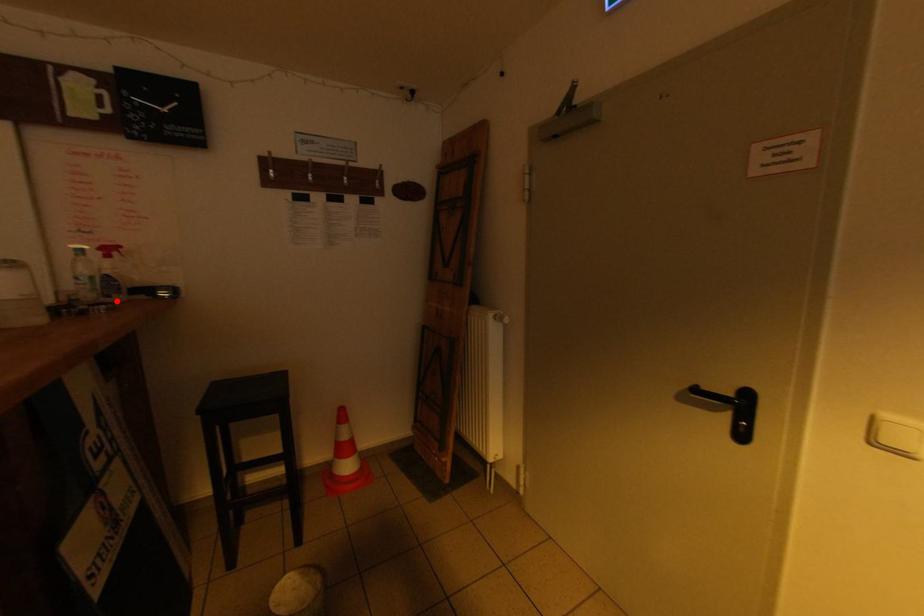
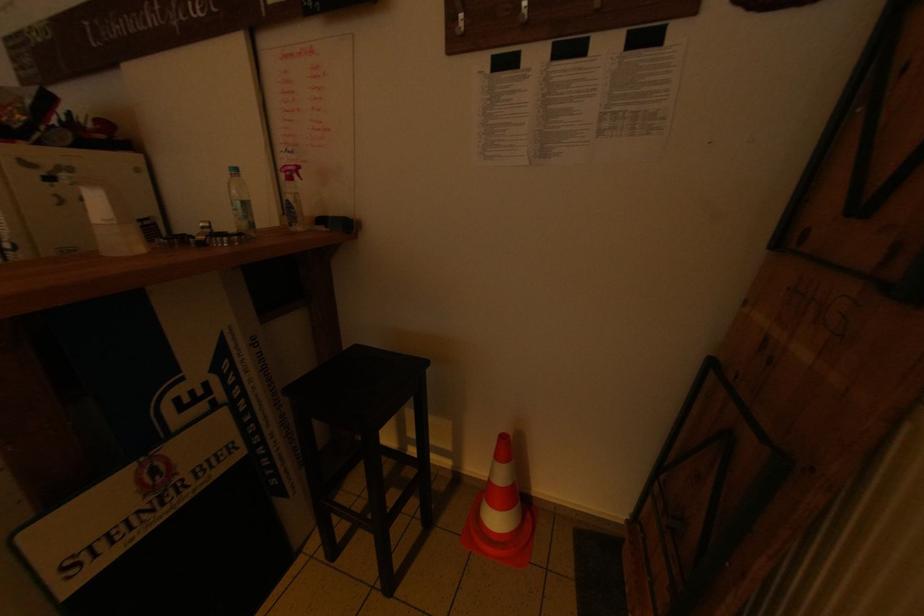
Question: I am providing you with two images of the same scene from different viewpoints. A red point is marked on the first image. Is the red point's position out of view in image 2?

Choices:
 (A) Yes
 (B) No

Answer: (B)